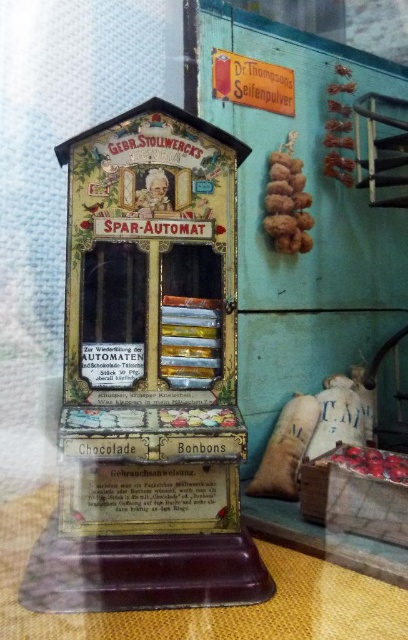
You are a customer standing in front of the vintage German chocolate and candy vending machine. You notice a point marked at coordinates (148, 376). What object is located at this point?

The point at coordinates (148, 376) marks the shiny metallic automat at center.

You are a customer standing in front of the vintage vending machine. You notice both the shiny metallic automat at center and the matte yellow sign at upper center. Which object is positioned higher up in the image?

The matte yellow sign at upper center is positioned higher up in the image than the shiny metallic automat at center.

You are a customer standing in front of the vintage vending machine. You notice two items of interest. Which object is bigger between the shiny metallic automat at center and the matte yellow sign at upper center?

The shiny metallic automat at center is larger in size than the matte yellow sign at upper center.